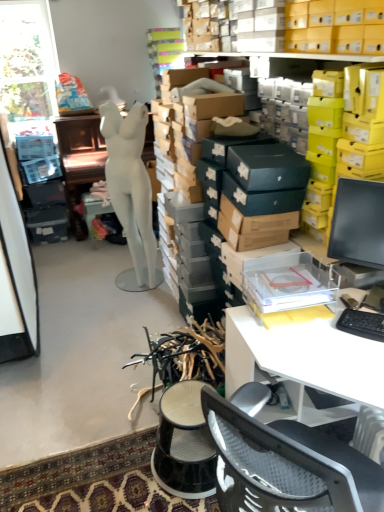
This screenshot has width=384, height=512. I want to click on white plastic desk at lower right, so click(303, 361).

In order to face black plastic stool at center, should I rotate leftwards or rightwards?

Turn left approximately 0.972 degrees to face it.

Locate an element on the screen. Image resolution: width=384 pixels, height=512 pixels. white matte mannequin at center is located at coordinates (131, 192).

From a real-world perspective, is yellow cardboard boxes at upper right located beneath black plastic stool at center?

Incorrect, from a real-world perspective, yellow cardboard boxes at upper right is higher than black plastic stool at center.

Where is `stool on the left side of yellow cardboard boxes at upper right`? The height and width of the screenshot is (512, 384). stool on the left side of yellow cardboard boxes at upper right is located at coordinates (184, 444).

Does yellow cardboard boxes at upper right have a lesser width compared to black plastic stool at center?

Yes.

Is black plastic stool at center located within yellow cardboard boxes at upper right?

Actually, black plastic stool at center is outside yellow cardboard boxes at upper right.

Based on the photo, who is bigger, white plastic desk at lower right or white matte mannequin at center?

white plastic desk at lower right is bigger.

How far apart are white plastic desk at lower right and white matte mannequin at center?

1.63 meters.

This screenshot has width=384, height=512. I want to click on person lying above the white plastic desk at lower right (from the image's perspective), so click(x=131, y=192).

From the image's perspective, relative to white matte mannequin at center, is white plastic desk at lower right above or below?

white plastic desk at lower right is situated lower than white matte mannequin at center in the image.

From a real-world perspective, which object stands above the other?

white plastic desk at lower right, from a real-world perspective.

From the image's perspective, is white plastic desk at lower right under black plastic stool at center?

Actually, white plastic desk at lower right appears above black plastic stool at center in the image.

Considering the relative positions of white plastic desk at lower right and black plastic stool at center in the image provided, is white plastic desk at lower right to the left of black plastic stool at center from the viewer's perspective?

In fact, white plastic desk at lower right is to the right of black plastic stool at center.

Which of these two, white plastic desk at lower right or black plastic stool at center, is wider?

Wider between the two is white plastic desk at lower right.

Which is behind, point (23, 44) or point (138, 172)?

The point (23, 44) is behind.

Where is `window that appears above the white matte mannequin at center (from a real-world perspective)`? This screenshot has width=384, height=512. window that appears above the white matte mannequin at center (from a real-world perspective) is located at coordinates (27, 60).

Consider the image. Would you say transparent glass window at upper left contains white matte mannequin at center?

No, transparent glass window at upper left does not contain white matte mannequin at center.

From a real-world perspective, is transparent glass window at upper left physically below white matte mannequin at center?

No, from a real-world perspective, transparent glass window at upper left is not below white matte mannequin at center.

Is black plastic keyboard at right wider or thinner than white matte mannequin at center?

In the image, black plastic keyboard at right appears to be more narrow than white matte mannequin at center.

Which is more to the right, black plastic keyboard at right or white matte mannequin at center?

black plastic keyboard at right is more to the right.

Considering the positions of objects black plastic keyboard at right and white matte mannequin at center in the image provided, who is behind, black plastic keyboard at right or white matte mannequin at center?

white matte mannequin at center is further from the camera.

How much distance is there between black plastic keyboard at right and white matte mannequin at center?

black plastic keyboard at right and white matte mannequin at center are 1.87 meters apart from each other.

Considering the positions of objects black plastic stool at center and transparent glass window at upper left in the image provided, who is more to the right, black plastic stool at center or transparent glass window at upper left?

Positioned to the right is black plastic stool at center.

Is black plastic stool at center far away from transparent glass window at upper left?

black plastic stool at center is far away from transparent glass window at upper left.

Who is shorter, black plastic stool at center or transparent glass window at upper left?

Standing shorter between the two is black plastic stool at center.

Is black plastic stool at center spatially inside transparent glass window at upper left, or outside of it?

black plastic stool at center cannot be found inside transparent glass window at upper left.

Who is shorter, white matte mannequin at center or black plastic stool at center?

Standing shorter between the two is black plastic stool at center.

Relative to black plastic stool at center, is white matte mannequin at center in front or behind?

white matte mannequin at center is behind black plastic stool at center.

Where is `stool located underneath the white matte mannequin at center (from a real-world perspective)`? Image resolution: width=384 pixels, height=512 pixels. stool located underneath the white matte mannequin at center (from a real-world perspective) is located at coordinates (184, 444).

Measure the distance between white matte mannequin at center and black plastic stool at center.

white matte mannequin at center is 2.91 meters from black plastic stool at center.

Where is `stool that appears on the left of yellow cardboard boxes at upper right`? stool that appears on the left of yellow cardboard boxes at upper right is located at coordinates (184, 444).

This screenshot has width=384, height=512. Find the location of `person behind the white plastic desk at lower right`. person behind the white plastic desk at lower right is located at coordinates (131, 192).

When comparing their distances from black plastic keyboard at right, does yellow cardboard boxes at upper right or transparent glass window at upper left seem further?

Based on the image, transparent glass window at upper left appears to be further to black plastic keyboard at right.

Estimate the real-world distances between objects in this image. Which object is further from yellow cardboard boxes at upper right, black plastic keyboard at right or black plastic stool at center?

black plastic stool at center lies further to yellow cardboard boxes at upper right than the other object.

When comparing their distances from white matte mannequin at center, does white plastic desk at lower right or white matte mannequin at center seem closer?

Based on the image, white matte mannequin at center appears to be nearer to white matte mannequin at center.

Estimate the real-world distances between objects in this image. Which object is further from black plastic stool at center, transparent glass window at upper left or black plastic keyboard at right?

The object further to black plastic stool at center is transparent glass window at upper left.

Consider the image. Which object lies further to the anchor point white plastic desk at lower right, yellow cardboard boxes at upper right or black plastic stool at center?

Based on the image, yellow cardboard boxes at upper right appears to be further to white plastic desk at lower right.

Estimate the real-world distances between objects in this image. Which object is closer to yellow cardboard boxes at upper right, white matte mannequin at center or white plastic desk at lower right?

white matte mannequin at center is positioned closer to the anchor yellow cardboard boxes at upper right.

Considering their positions, is black plastic stool at center positioned further to transparent glass window at upper left than white plastic desk at lower right?

black plastic stool at center is positioned further to the anchor transparent glass window at upper left.

Which object lies nearer to the anchor point black plastic keyboard at right, transparent glass window at upper left or white matte mannequin at center?

white matte mannequin at center lies closer to black plastic keyboard at right than the other object.

The width and height of the screenshot is (384, 512). I want to click on stool between white plastic desk at lower right and white matte mannequin at center in the front-back direction, so click(x=184, y=444).

Where is `shelf between white matte mannequin at center and black plastic keyboard at right in the horizontal direction`? shelf between white matte mannequin at center and black plastic keyboard at right in the horizontal direction is located at coordinates [332, 27].

Image resolution: width=384 pixels, height=512 pixels. In order to click on computer keyboard located between white plastic desk at lower right and white matte mannequin at center in the depth direction in this screenshot , I will do `click(362, 324)`.

Locate an element on the screen. This screenshot has height=512, width=384. person between black plastic stool at center and white matte mannequin at center from front to back is located at coordinates (131, 192).